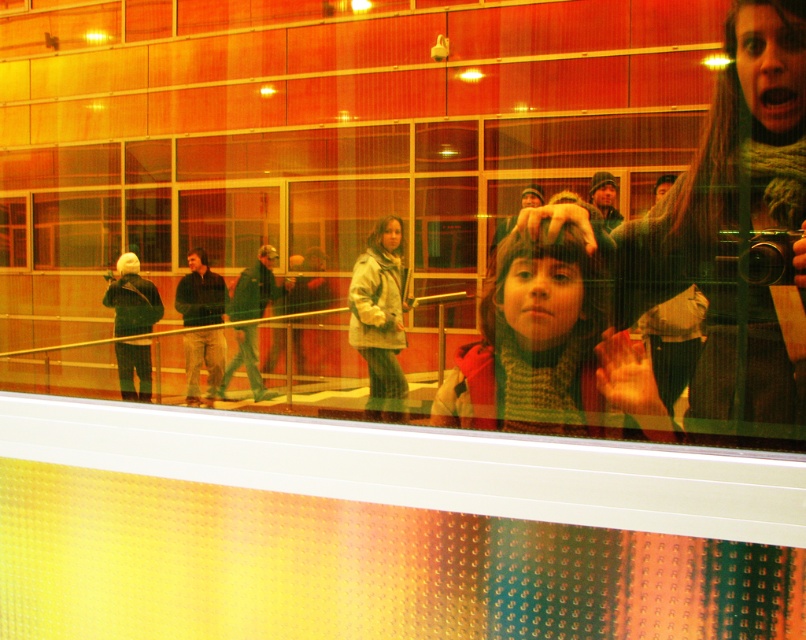
Does point (447, 420) come closer to viewer compared to point (379, 298)?

That is True.

Is knitted scarf at center positioned at the back of matte gray coat at center?

No, knitted scarf at center is in front of matte gray coat at center.

Is point (588, 384) positioned after point (381, 320)?

No, it is not.

Image resolution: width=806 pixels, height=640 pixels. Find the location of `knitted scarf at center`. knitted scarf at center is located at coordinates (550, 342).

Is point (796, 276) less distant than point (517, 428)?

No, (796, 276) is behind (517, 428).

Which is above, knitted scarf at right or knitted scarf at center?

knitted scarf at right

Find the location of `knitted scarf at right`. knitted scarf at right is located at coordinates (733, 230).

Find the location of a particular element. knitted scarf at right is located at coordinates (733, 230).

At what (x,y) coordinates should I click in order to perform the action: click on knitted scarf at right. Please return your answer as a coordinate pair (x, y). The height and width of the screenshot is (640, 806). Looking at the image, I should click on (733, 230).

Does knitted scarf at right have a greater height compared to matte gray coat at center?

Incorrect, knitted scarf at right's height is not larger of matte gray coat at center's.

Which is in front, point (788, 26) or point (393, 376)?

Point (788, 26) is in front.

Locate an element on the screen. knitted scarf at right is located at coordinates (733, 230).